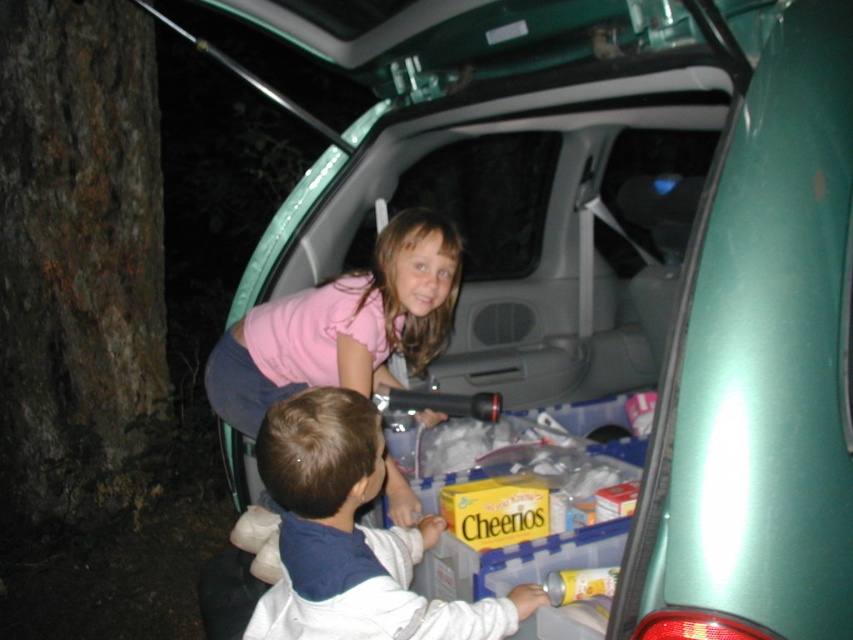
Question: Does white fleece jacket at lower center appear under pink fabric shirt at center?

Choices:
 (A) yes
 (B) no

Answer: (A)

Question: Which of the following is the farthest from the observer?

Choices:
 (A) (352, 289)
 (B) (258, 637)

Answer: (A)

Question: Which object appears closest to the camera in this image?

Choices:
 (A) white fleece jacket at lower center
 (B) pink fabric shirt at center

Answer: (A)

Question: Is white fleece jacket at lower center bigger than pink fabric shirt at center?

Choices:
 (A) yes
 (B) no

Answer: (B)

Question: Which of the following is the farthest from the observer?

Choices:
 (A) pink fabric shirt at center
 (B) white fleece jacket at lower center

Answer: (A)

Question: Is the position of white fleece jacket at lower center less distant than that of pink fabric shirt at center?

Choices:
 (A) yes
 (B) no

Answer: (A)